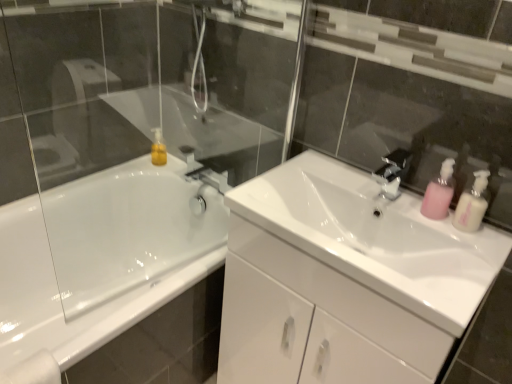
The height and width of the screenshot is (384, 512). Find the location of `free point in front of pink plastic soap dispenser at right, acting as the second soap dispenser starting from the right`. free point in front of pink plastic soap dispenser at right, acting as the second soap dispenser starting from the right is located at coordinates (454, 253).